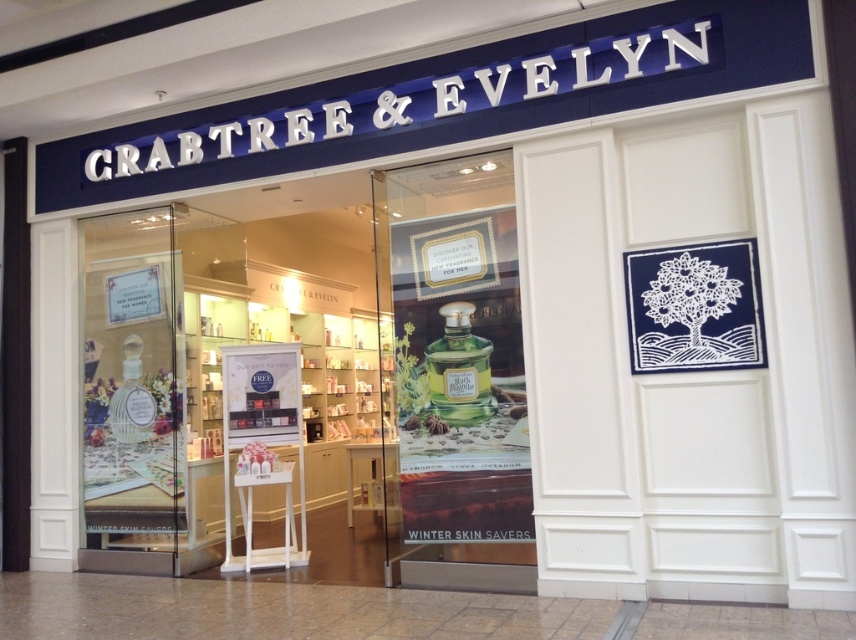
Question: Is green glass perfume bottle at center to the left of green glass bottle at center from the viewer's perspective?

Choices:
 (A) no
 (B) yes

Answer: (B)

Question: Which of the following is the closest to the observer?

Choices:
 (A) green glass perfume bottle at center
 (B) green glass bottle at center

Answer: (B)

Question: Can you confirm if green glass perfume bottle at center is wider than green glass bottle at center?

Choices:
 (A) yes
 (B) no

Answer: (B)

Question: Is green glass perfume bottle at center positioned at the back of green glass bottle at center?

Choices:
 (A) yes
 (B) no

Answer: (A)

Question: Which point appears farthest from the camera in this image?

Choices:
 (A) (128, 424)
 (B) (521, 593)

Answer: (A)